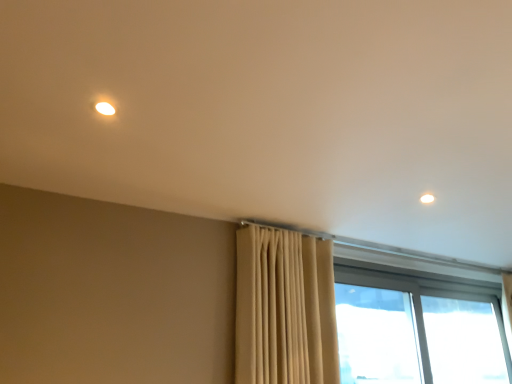
Question: Can you confirm if beige fabric curtain at center is shorter than transparent glass window at lower right, which is counted as the second window, starting from the right?

Choices:
 (A) no
 (B) yes

Answer: (A)

Question: Is beige fabric curtain at center touching transparent glass window at lower right, which is counted as the second window, starting from the right?

Choices:
 (A) no
 (B) yes

Answer: (A)

Question: Is beige fabric curtain at center behind transparent glass window at lower right, which is counted as the second window, starting from the right?

Choices:
 (A) yes
 (B) no

Answer: (B)

Question: From a real-world perspective, is beige fabric curtain at center on transparent glass window at lower right, marked as the first window in a left-to-right arrangement?

Choices:
 (A) no
 (B) yes

Answer: (B)

Question: Is beige fabric curtain at center positioned beyond the bounds of transparent glass window at lower right, which is counted as the second window, starting from the right?

Choices:
 (A) yes
 (B) no

Answer: (A)

Question: Considering the positions of transparent glass window at lower right, which is counted as the second window, starting from the right, and beige fabric curtain at center in the image, is transparent glass window at lower right, which is counted as the second window, starting from the right, bigger or smaller than beige fabric curtain at center?

Choices:
 (A) big
 (B) small

Answer: (B)

Question: Is transparent glass window at lower right, marked as the first window in a left-to-right arrangement, spatially inside beige fabric curtain at center, or outside of it?

Choices:
 (A) inside
 (B) outside

Answer: (B)

Question: From the image's perspective, is transparent glass window at lower right, marked as the first window in a left-to-right arrangement, above or below beige fabric curtain at center?

Choices:
 (A) below
 (B) above

Answer: (A)

Question: From a real-world perspective, is transparent glass window at lower right, which is counted as the second window, starting from the right, above or below beige fabric curtain at center?

Choices:
 (A) above
 (B) below

Answer: (B)

Question: From their relative heights in the image, would you say transparent glass window at lower right, which is counted as the second window, starting from the right, is taller or shorter than transparent glass window at right, the first window when ordered from right to left?

Choices:
 (A) short
 (B) tall

Answer: (A)

Question: In terms of width, does transparent glass window at lower right, marked as the first window in a left-to-right arrangement, look wider or thinner when compared to transparent glass window at right, the 2th window when ordered from left to right?

Choices:
 (A) wide
 (B) thin

Answer: (B)

Question: In the image, is transparent glass window at lower right, which is counted as the second window, starting from the right, positioned in front of or behind transparent glass window at right, the first window when ordered from right to left?

Choices:
 (A) behind
 (B) front

Answer: (B)

Question: From the image's perspective, is transparent glass window at lower right, which is counted as the second window, starting from the right, positioned above or below transparent glass window at right, the first window when ordered from right to left?

Choices:
 (A) below
 (B) above

Answer: (B)

Question: Is beige fabric curtain at center situated inside transparent glass window at right, the 2th window when ordered from left to right, or outside?

Choices:
 (A) inside
 (B) outside

Answer: (B)

Question: From a real-world perspective, is beige fabric curtain at center physically located above or below transparent glass window at right, the first window when ordered from right to left?

Choices:
 (A) above
 (B) below

Answer: (A)